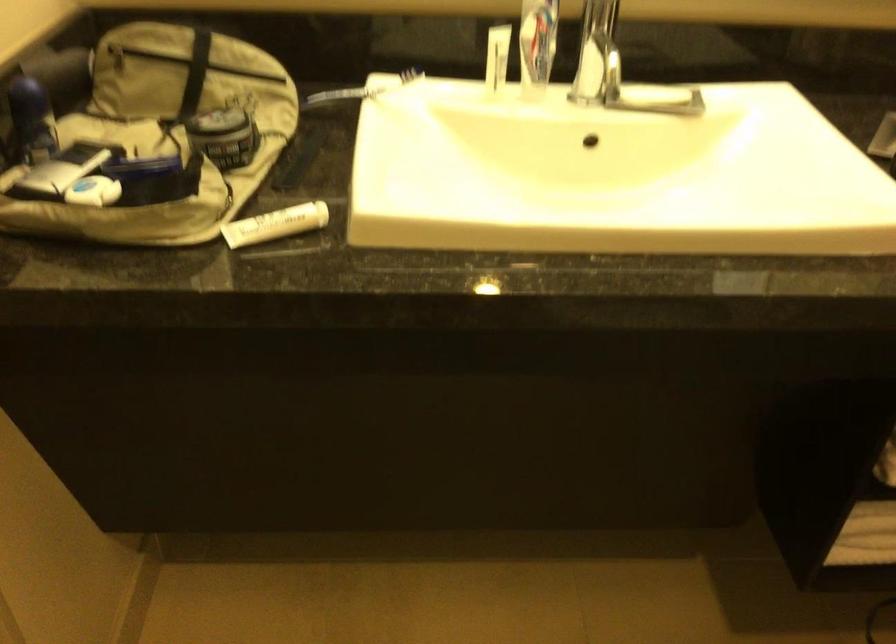
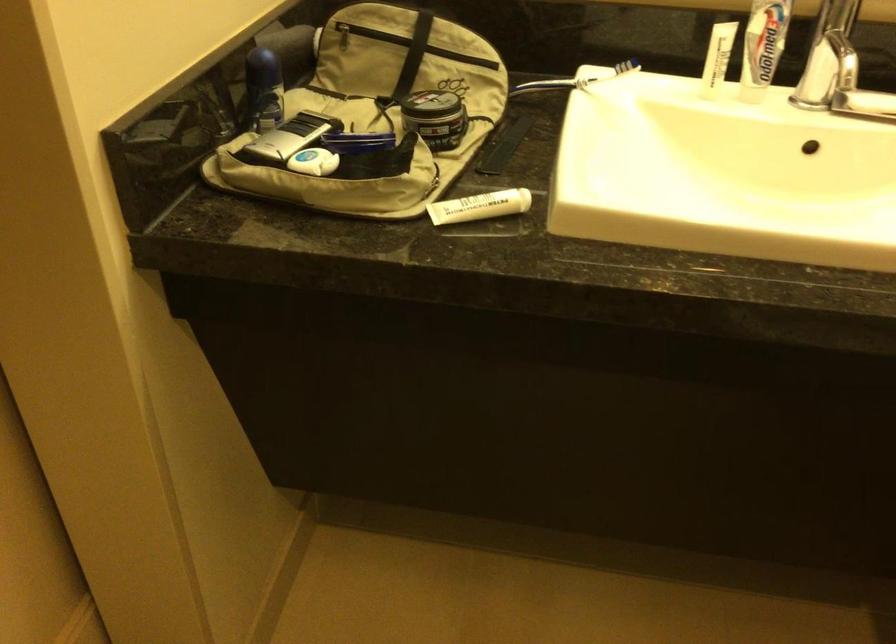
Locate, in the second image, the point that corresponds to [297,161] in the first image.

(503, 146)